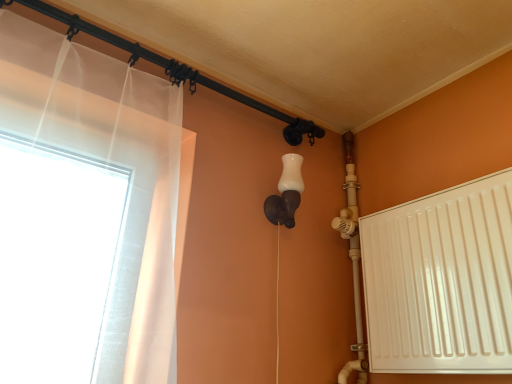
Question: Is black metal pipe at upper left spatially inside white matte radiator at right, or outside of it?

Choices:
 (A) inside
 (B) outside

Answer: (B)

Question: Relative to white matte radiator at right, is black metal pipe at upper left in front or behind?

Choices:
 (A) behind
 (B) front

Answer: (A)

Question: Which is nearer to the white matte wall sconce at center?

Choices:
 (A) black metal pipe at upper left
 (B) white matte radiator at right

Answer: (A)

Question: Considering the real-world distances, which object is farthest from the white matte wall sconce at center?

Choices:
 (A) black metal pipe at upper left
 (B) white matte radiator at right

Answer: (B)